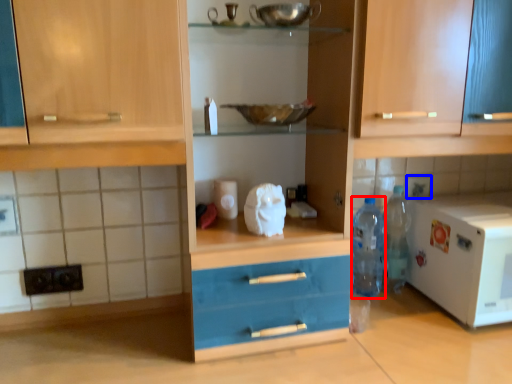
Question: Which of the following is the closest to the observer, bottle (highlighted by a red box) or tile (highlighted by a blue box)?

Choices:
 (A) bottle
 (B) tile

Answer: (A)